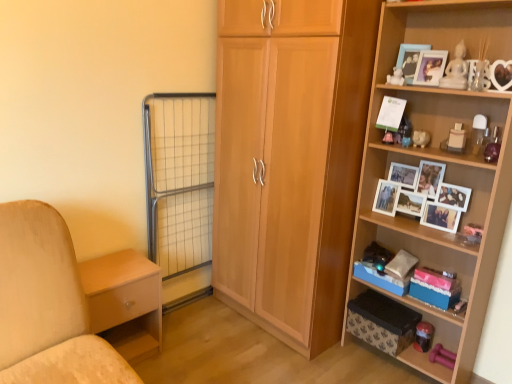
Locate an element on the screen. The image size is (512, 384). free space below metal grid screen door at lower left (from a real-world perspective) is located at coordinates 186,306.